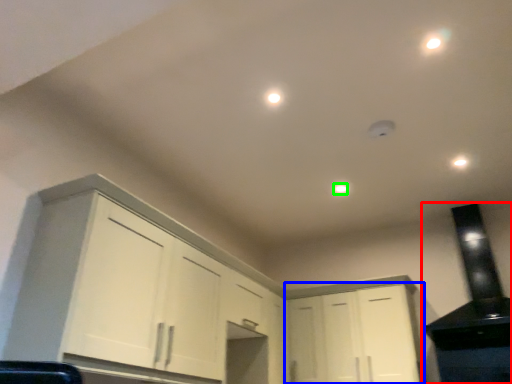
Question: Which object is the closest to the appliance (highlighted by a red box)? Choose among these: cabinetry (highlighted by a blue box) or dot (highlighted by a green box).

Choices:
 (A) cabinetry
 (B) dot

Answer: (A)